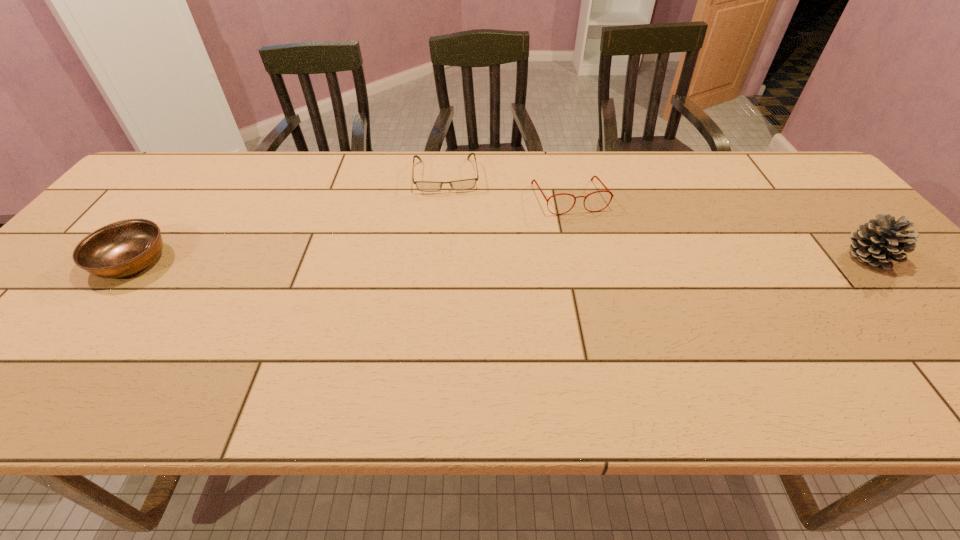
The height and width of the screenshot is (540, 960). I want to click on empty space between the soup bowl and the tallest object, so click(x=500, y=259).

At what (x,y) coordinates should I click in order to perform the action: click on free space between the right spectacles and the leftmost object. Please return your answer as a coordinate pair (x, y). Image resolution: width=960 pixels, height=540 pixels. Looking at the image, I should click on (350, 230).

This screenshot has height=540, width=960. Find the location of `vacant area that lies between the leftmost object and the pinecone`. vacant area that lies between the leftmost object and the pinecone is located at coordinates (500, 259).

Find the location of a particular element. The image size is (960, 540). free space between the tallest object and the taller spectacles is located at coordinates (719, 227).

Locate which object ranks third in proximity to the shorter spectacles. Please provide its 2D coordinates. Your answer should be formatted as a tuple, i.e. [(x, y)], where the tuple contains the x and y coordinates of a point satisfying the conditions above.

[(877, 242)]

Locate an element on the screen. The image size is (960, 540). the second closest object to the shorter spectacles is located at coordinates (122, 248).

At what (x,y) coordinates should I click in order to perform the action: click on blank space that satisfies the following two spatial constraints: 1. on the back side of the shorter spectacles; 2. on the right side of the leftmost object. Please return your answer as a coordinate pair (x, y). Looking at the image, I should click on (199, 176).

This screenshot has width=960, height=540. Find the location of `free point that satisfies the following two spatial constraints: 1. on the back side of the soup bowl; 2. on the right side of the right spectacles`. free point that satisfies the following two spatial constraints: 1. on the back side of the soup bowl; 2. on the right side of the right spectacles is located at coordinates (181, 198).

Find the location of a particular element. The image size is (960, 540). free point that satisfies the following two spatial constraints: 1. on the back side of the soup bowl; 2. on the right side of the tallest object is located at coordinates (134, 257).